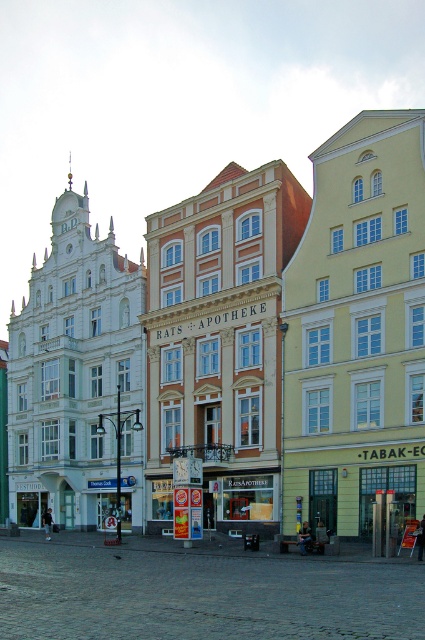
You are a pedestrian standing on the sidewalk in front of the three buildings. You want to enter the matte glass storefront at center. Which direction should you walk relative to the matte white building at center?

You should walk to the right relative to the matte white building at center because the matte white building at center is to the left of the matte glass storefront at center.

You are standing on the street and want to take a photo of the matte white building at center and the matte glass storefront at center. Which one will appear larger in the photo?

The matte white building at center will appear larger in the photo because it is in front of the matte glass storefront at center, making it closer to the camera and thus appear bigger.

You are a delivery person standing at the entrance of the matte white building at center. You need to deliver a package to the address located 200 feet away from the building. Is the destination beyond the building or in front of it?

The matte white building at center is 184.72 feet away from the viewer. Since the destination is 200 feet away, it is beyond the building.